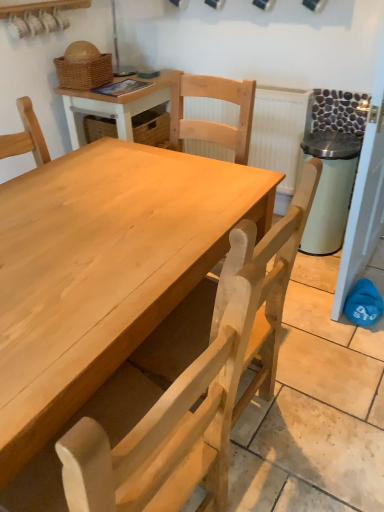
Question: Is white textured radiator at upper center surrounded by woven brown basket at upper left?

Choices:
 (A) no
 (B) yes

Answer: (A)

Question: Can you confirm if woven brown basket at upper left is positioned to the right of white textured radiator at upper center?

Choices:
 (A) yes
 (B) no

Answer: (B)

Question: Considering the relative sizes of woven brown basket at upper left and white textured radiator at upper center in the image provided, is woven brown basket at upper left smaller than white textured radiator at upper center?

Choices:
 (A) yes
 (B) no

Answer: (A)

Question: Does woven brown basket at upper left come behind white textured radiator at upper center?

Choices:
 (A) no
 (B) yes

Answer: (A)

Question: Can you confirm if woven brown basket at upper left is thinner than white textured radiator at upper center?

Choices:
 (A) yes
 (B) no

Answer: (B)

Question: Is point (109, 70) closer or farther from the camera than point (114, 105)?

Choices:
 (A) closer
 (B) farther

Answer: (B)

Question: From the image's perspective, is woven brown basket at upper left above or below wooden table at center?

Choices:
 (A) above
 (B) below

Answer: (A)

Question: Based on their sizes in the image, would you say woven brown basket at upper left is bigger or smaller than wooden table at center?

Choices:
 (A) big
 (B) small

Answer: (B)

Question: Choose the correct answer: Is woven brown basket at upper left inside wooden table at center or outside it?

Choices:
 (A) inside
 (B) outside

Answer: (B)

Question: Is wooden table at center taller or shorter than woven brown basket at upper left?

Choices:
 (A) tall
 (B) short

Answer: (A)

Question: Is point (150, 101) closer or farther from the camera than point (77, 74)?

Choices:
 (A) closer
 (B) farther

Answer: (B)

Question: Looking at the image, does wooden table at center seem bigger or smaller compared to woven brown basket at upper left?

Choices:
 (A) big
 (B) small

Answer: (A)

Question: Considering the positions of wooden table at center and woven brown basket at upper left in the image, is wooden table at center wider or thinner than woven brown basket at upper left?

Choices:
 (A) thin
 (B) wide

Answer: (B)

Question: From a real-world perspective, is natural wood chair at center positioned above or below woven brown basket at upper left?

Choices:
 (A) below
 (B) above

Answer: (A)

Question: Looking at their shapes, would you say natural wood chair at center is wider or thinner than woven brown basket at upper left?

Choices:
 (A) wide
 (B) thin

Answer: (A)